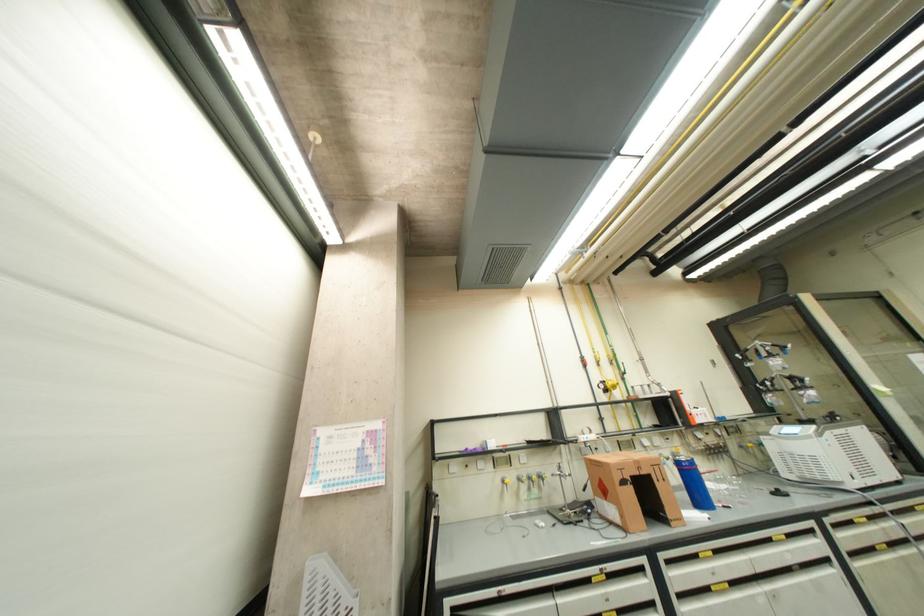
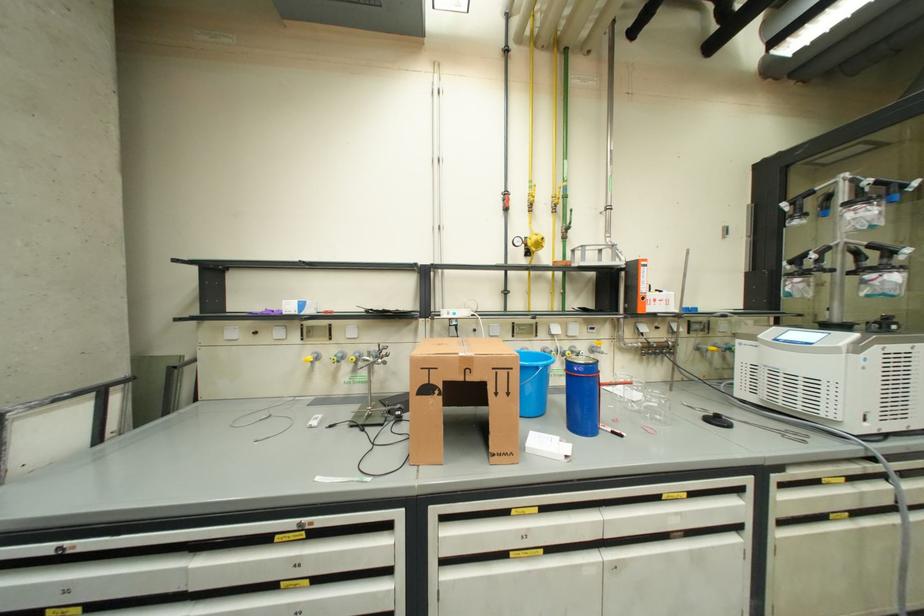
In a continuous first-person perspective shot, in which direction is the camera moving?

The cameraman walked toward right, forward.